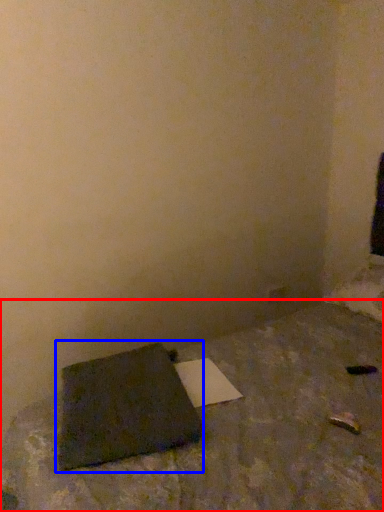
Question: Among these objects, which one is farthest to the camera, furniture (highlighted by a red box) or notebook (highlighted by a blue box)?

Choices:
 (A) furniture
 (B) notebook

Answer: (B)